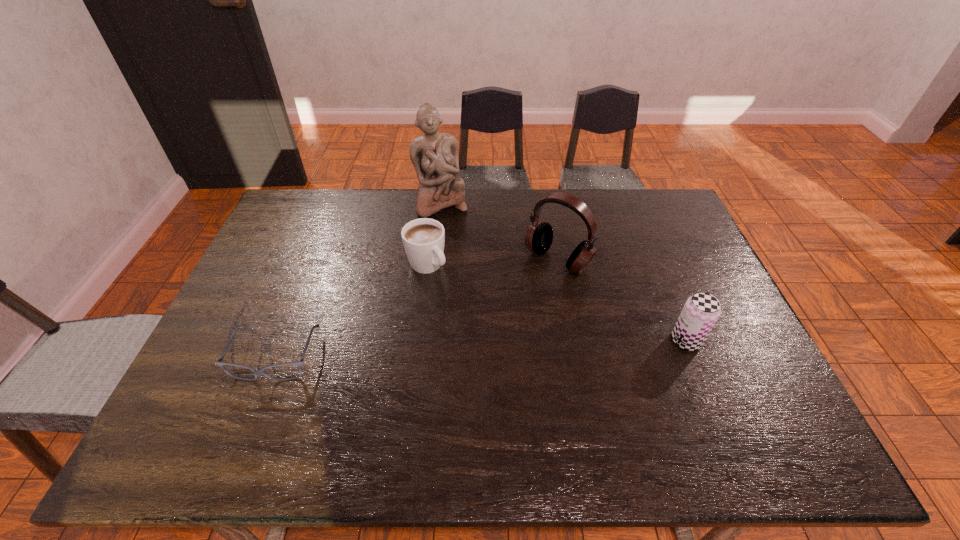
Locate an element on the screen. The image size is (960, 540). the closest object to the rightmost object is located at coordinates coord(539,236).

Select which object appears as the fourth closest to the rightmost object. Please provide its 2D coordinates. Your answer should be formatted as a tuple, i.e. [(x, y)], where the tuple contains the x and y coordinates of a point satisfying the conditions above.

[(299, 364)]